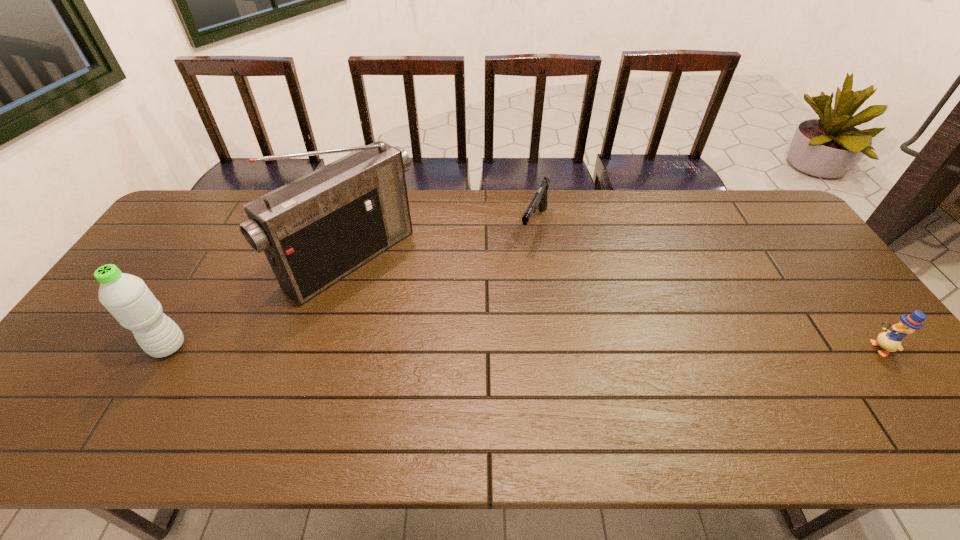
In order to click on free space at the near edge in this screenshot , I will do `click(738, 389)`.

Where is `vacant space at the right edge of the desktop`? vacant space at the right edge of the desktop is located at coordinates (771, 256).

I want to click on vacant space at the near left corner, so click(60, 392).

This screenshot has width=960, height=540. I want to click on vacant space at the far right corner of the desktop, so click(x=748, y=199).

This screenshot has width=960, height=540. I want to click on empty location between the leftmost object and the gun, so click(351, 286).

Where is `free space between the third object from right to left and the duckling`? free space between the third object from right to left and the duckling is located at coordinates (616, 304).

Where is `unoccupied position between the gun and the duckling`? Image resolution: width=960 pixels, height=540 pixels. unoccupied position between the gun and the duckling is located at coordinates (708, 286).

The width and height of the screenshot is (960, 540). I want to click on vacant region between the gun and the duckling, so click(x=708, y=286).

Where is `free space that is in between the third object from left to right and the radio receiver`? free space that is in between the third object from left to right and the radio receiver is located at coordinates (444, 243).

The height and width of the screenshot is (540, 960). Find the location of `unoccupied area between the third object from left to right and the third object from right to left`. unoccupied area between the third object from left to right and the third object from right to left is located at coordinates (444, 243).